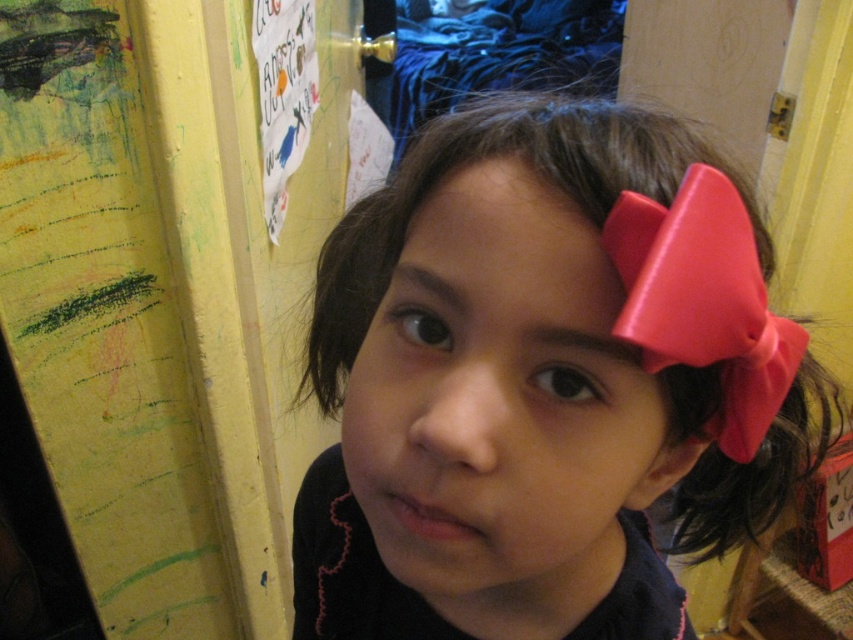
Can you confirm if pink matte bow at center is bigger than pink satin bow at right?

Yes.

Which of these two, pink matte bow at center or pink satin bow at right, stands shorter?

pink satin bow at right

Between point (383, 493) and point (724, 324), which one is positioned behind?

The point (383, 493) is more distant.

Where is `pink matte bow at center`? The image size is (853, 640). pink matte bow at center is located at coordinates (531, 392).

Which is in front, point (659, 256) or point (479, 280)?

Point (659, 256) is in front.

Does pink satin bow at right appear on the right side of smooth skin at center?

Correct, you'll find pink satin bow at right to the right of smooth skin at center.

Is point (733, 449) behind point (479, 260)?

That is True.

Image resolution: width=853 pixels, height=640 pixels. Find the location of `pink satin bow at right`. pink satin bow at right is located at coordinates (704, 301).

Is pink matte bow at center taller than smooth skin at center?

Yes.

Who is positioned more to the right, pink matte bow at center or smooth skin at center?

pink matte bow at center

What do you see at coordinates (531, 392) in the screenshot? The image size is (853, 640). I see `pink matte bow at center` at bounding box center [531, 392].

At what (x,y) coordinates should I click in order to perform the action: click on pink matte bow at center. Please return your answer as a coordinate pair (x, y). The width and height of the screenshot is (853, 640). Looking at the image, I should click on (531, 392).